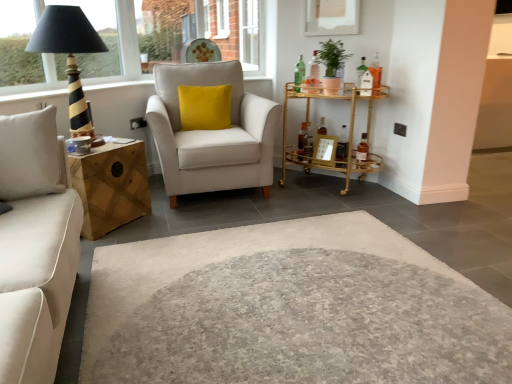
Question: Considering the relative sizes of wooden picture frame at center and woodenwoodennightstand at left in the image provided, is wooden picture frame at center smaller than woodenwoodennightstand at left?

Choices:
 (A) yes
 (B) no

Answer: (A)

Question: Does wooden picture frame at center have a lesser width compared to woodenwoodennightstand at left?

Choices:
 (A) no
 (B) yes

Answer: (B)

Question: Could you tell me if wooden picture frame at center is turned towards woodenwoodennightstand at left?

Choices:
 (A) no
 (B) yes

Answer: (A)

Question: From a real-world perspective, is wooden picture frame at center located beneath woodenwoodennightstand at left?

Choices:
 (A) no
 (B) yes

Answer: (A)

Question: From the image's perspective, is wooden picture frame at center over woodenwoodennightstand at left?

Choices:
 (A) yes
 (B) no

Answer: (A)

Question: Considering the relative sizes of wooden picture frame at center and woodenwoodennightstand at left in the image provided, is wooden picture frame at center taller than woodenwoodennightstand at left?

Choices:
 (A) yes
 (B) no

Answer: (B)

Question: Is woodenwoodennightstand at left directly adjacent to gold metallic bar cart at right?

Choices:
 (A) no
 (B) yes

Answer: (A)

Question: Is woodenwoodennightstand at left turned away from gold metallic bar cart at right?

Choices:
 (A) yes
 (B) no

Answer: (B)

Question: Is woodenwoodennightstand at left at the right side of gold metallic bar cart at right?

Choices:
 (A) no
 (B) yes

Answer: (A)

Question: From the image's perspective, does woodenwoodennightstand at left appear higher than gold metallic bar cart at right?

Choices:
 (A) no
 (B) yes

Answer: (A)

Question: Is woodenwoodennightstand at left positioned far away from gold metallic bar cart at right?

Choices:
 (A) yes
 (B) no

Answer: (A)

Question: Does woodenwoodennightstand at left have a greater height compared to gold metallic bar cart at right?

Choices:
 (A) yes
 (B) no

Answer: (B)

Question: Is gold metallic bar cart at right turned away from green matte plant at upper right?

Choices:
 (A) yes
 (B) no

Answer: (B)